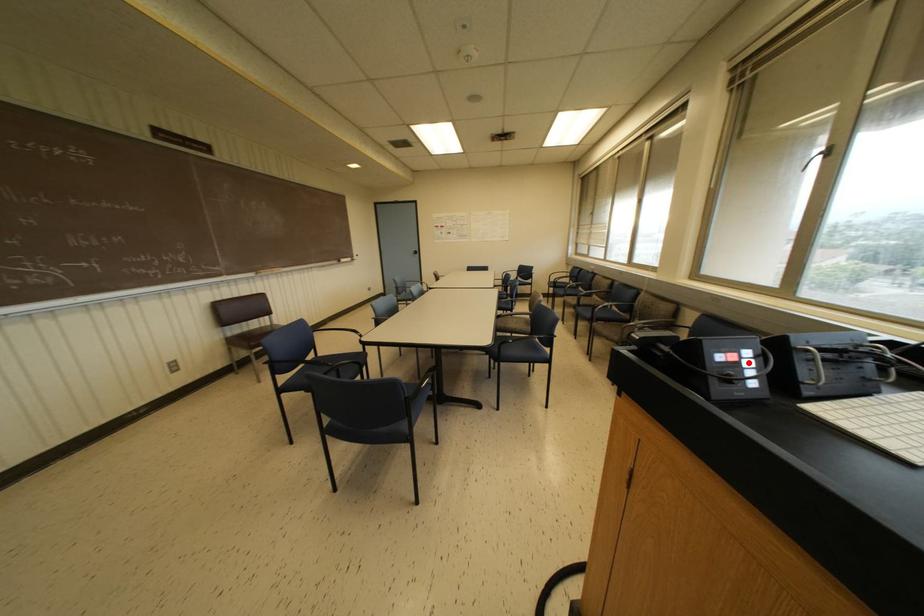
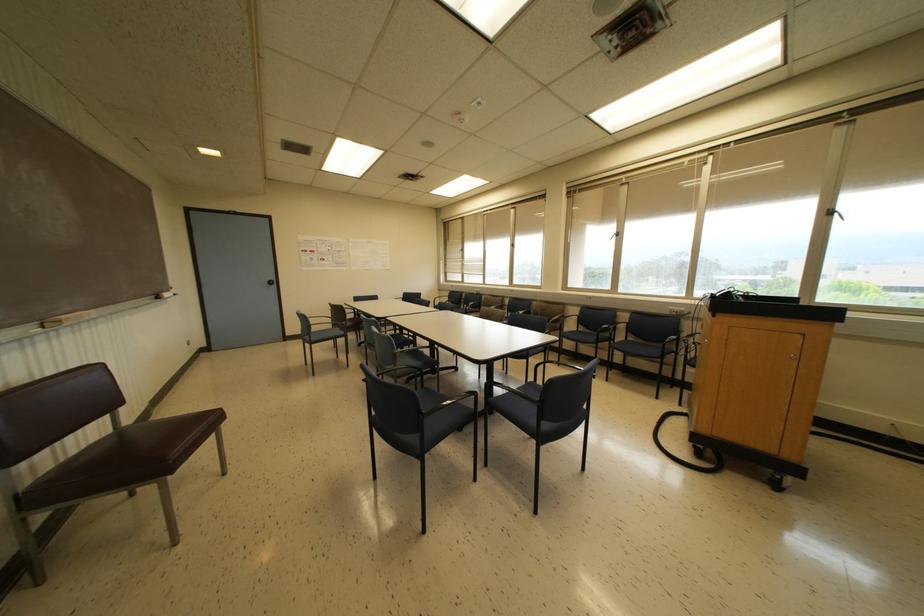
Question: I am providing you with two images of the same scene from different viewpoints. A red point is marked on the first image. At the location where the point appears in image 1, is it still visible in image 2?

Choices:
 (A) Yes
 (B) No

Answer: (B)